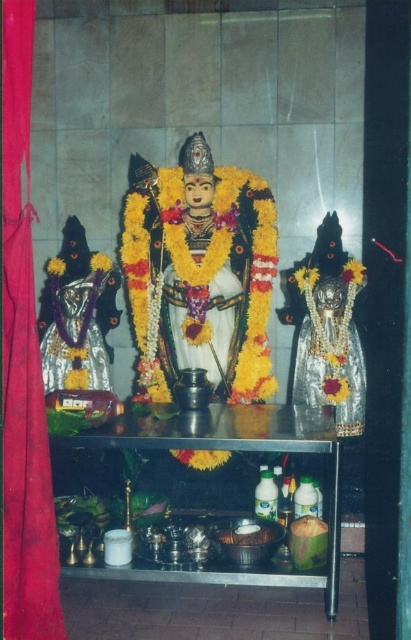
Does point (157, 291) come farther from viewer compared to point (251, 528)?

Yes, point (157, 291) is farther from viewer.

Is white glossy statue at center below white matte coconut at center?

No, white glossy statue at center is not below white matte coconut at center.

Find the location of a particular element. The width and height of the screenshot is (411, 640). white glossy statue at center is located at coordinates (200, 273).

At what (x,y) coordinates should I click in order to perform the action: click on white glossy statue at center. Please return your answer as a coordinate pair (x, y). The width and height of the screenshot is (411, 640). Looking at the image, I should click on (200, 273).

Is white glossy statue at center to the right of metallic table at center from the viewer's perspective?

No, white glossy statue at center is not to the right of metallic table at center.

The image size is (411, 640). I want to click on white glossy statue at center, so click(x=200, y=273).

From the picture: Can you confirm if metallic table at center is bigger than white matte coconut at center?

Correct, metallic table at center is larger in size than white matte coconut at center.

Is point (196, 435) farther from camera compared to point (233, 532)?

No.

Where is `metallic table at center`? metallic table at center is located at coordinates (237, 445).